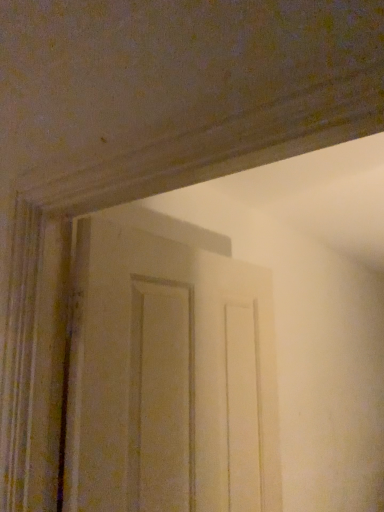
Describe the element at coordinates (169, 378) in the screenshot. This screenshot has height=512, width=384. I see `matte wooden door at center` at that location.

Identify the location of matte wooden door at center. (169, 378).

Locate an element on the screen. The image size is (384, 512). matte wooden door at center is located at coordinates (169, 378).